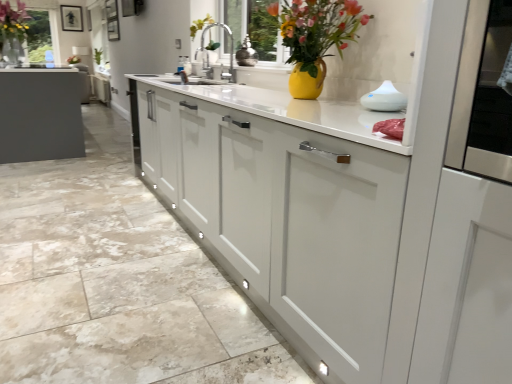
Question: Which direction should I rotate to look at shiny metallic vase at center, positioned as the first appliance in left-to-right order?

Choices:
 (A) left
 (B) right

Answer: (A)

Question: Does white glossy diffuser at upper right, placed as the first appliance when sorted from bottom to top, have a lesser width compared to shiny metallic vase at center, the second appliance in the front-to-back sequence?

Choices:
 (A) yes
 (B) no

Answer: (A)

Question: Could you tell me if white glossy diffuser at upper right, placed as the first appliance when sorted from bottom to top, is facing shiny metallic vase at center, the second appliance in the front-to-back sequence?

Choices:
 (A) no
 (B) yes

Answer: (A)

Question: Is the position of white glossy diffuser at upper right, the 2th appliance positioned from the back, more distant than that of shiny metallic vase at center, the second appliance in the front-to-back sequence?

Choices:
 (A) yes
 (B) no

Answer: (B)

Question: Can you confirm if white glossy diffuser at upper right, which is counted as the second appliance, starting from the left, is positioned to the right of shiny metallic vase at center, the second appliance viewed from the right?

Choices:
 (A) yes
 (B) no

Answer: (A)

Question: Can you confirm if white glossy diffuser at upper right, which is counted as the second appliance, starting from the left, is bigger than shiny metallic vase at center, the second appliance in the front-to-back sequence?

Choices:
 (A) no
 (B) yes

Answer: (A)

Question: Would you say shiny metallic vase at center, arranged as the second appliance when ordered from the bottom, is part of white glossy diffuser at upper right, arranged as the 1th appliance when viewed from the right,'s contents?

Choices:
 (A) no
 (B) yes

Answer: (A)

Question: Does white matte cabinet at center, which is the 1th cabinetry in top-to-bottom order, appear on the left side of matte black picture frame at upper center?

Choices:
 (A) no
 (B) yes

Answer: (A)

Question: Is white matte cabinet at center, positioned as the second cabinetry in bottom-to-top order, further to the viewer compared to matte black picture frame at upper center?

Choices:
 (A) no
 (B) yes

Answer: (A)

Question: Can you confirm if white matte cabinet at center, marked as the 2th cabinetry in a front-to-back arrangement, is positioned to the right of matte black picture frame at upper center?

Choices:
 (A) yes
 (B) no

Answer: (A)

Question: From a real-world perspective, is white matte cabinet at center, which is the 1th cabinetry in top-to-bottom order, physically above matte black picture frame at upper center?

Choices:
 (A) no
 (B) yes

Answer: (A)

Question: From a real-world perspective, is white matte cabinet at center, marked as the 2th cabinetry in a front-to-back arrangement, below matte black picture frame at upper center?

Choices:
 (A) yes
 (B) no

Answer: (A)

Question: Is white matte cabinet at center, positioned as the second cabinetry in bottom-to-top order, smaller than matte black picture frame at upper center?

Choices:
 (A) yes
 (B) no

Answer: (B)

Question: Can white matte cabinet at center, marked as the 2th cabinetry in a front-to-back arrangement, be found inside matte white cabinet at center, which is the first cabinetry in bottom-to-top order?

Choices:
 (A) no
 (B) yes

Answer: (A)